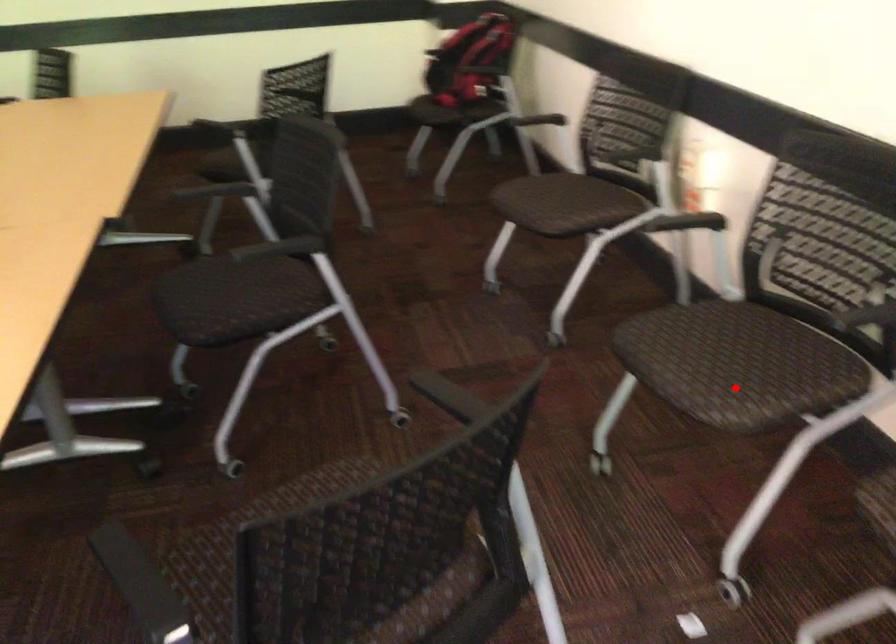
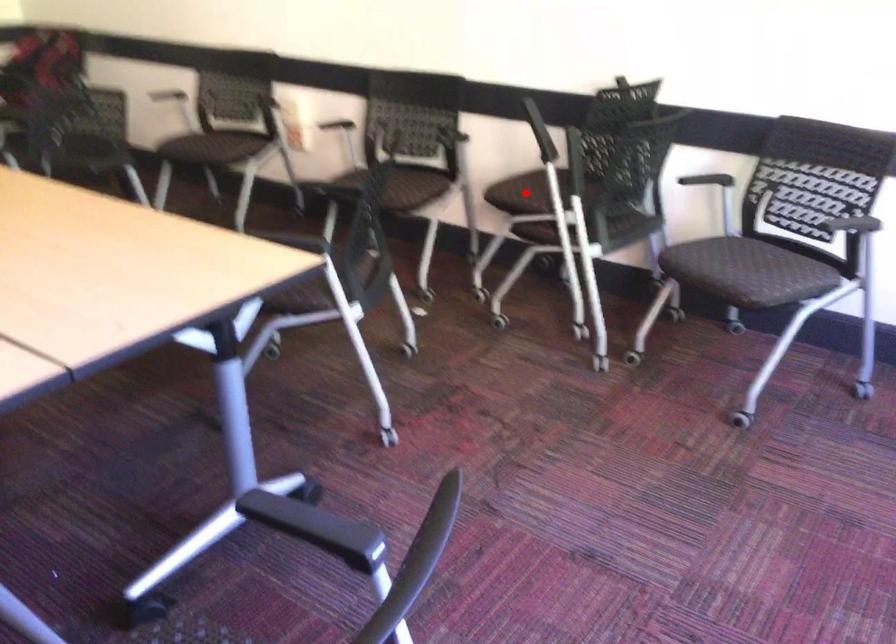
I am providing you with two images of the same scene from different viewpoints. A red point is marked on the first image and another point is marked on the second image. Is the red point in image1 aligned with the point shown in image2?

No